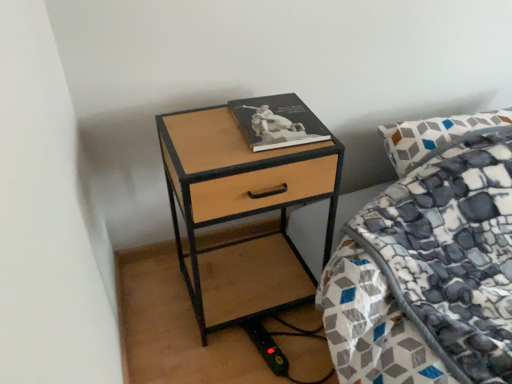
In order to face woodenmaterial/texturenightstand at center, should I rotate leftwards or rightwards?

To face it directly, rotate left by 1.128 degrees.

The height and width of the screenshot is (384, 512). Describe the element at coordinates (239, 188) in the screenshot. I see `woodenmaterial/texturenightstand at center` at that location.

Locate an element on the screen. woodenmaterial/texturenightstand at center is located at coordinates (239, 188).

Measure the distance between point (x=302, y=110) and camera.

Point (x=302, y=110) is 1.16 meters from camera.

What do you see at coordinates (277, 122) in the screenshot? The image size is (512, 384). I see `hardcover book at upper right` at bounding box center [277, 122].

Find the location of a particular element. This screenshot has height=384, width=512. hardcover book at upper right is located at coordinates (277, 122).

The height and width of the screenshot is (384, 512). Identify the location of woodenmaterial/texturenightstand at center. (239, 188).

Which object is positioned more to the right, woodenmaterial/texturenightstand at center or hardcover book at upper right?

Positioned to the right is hardcover book at upper right.

Is woodenmaterial/texturenightstand at center behind hardcover book at upper right?

No, it is not.

In the scene shown: Which point is more forward, (182, 151) or (268, 111)?

Positioned in front is point (182, 151).

From the image's perspective, is woodenmaterial/texturenightstand at center located above or below hardcover book at upper right?

Clearly, from the image's perspective, woodenmaterial/texturenightstand at center is below hardcover book at upper right.

From a real-world perspective, which object stands above the other?

In real-world perspective, hardcover book at upper right is above.

Is woodenmaterial/texturenightstand at center wider than hardcover book at upper right?

Yes.

Does woodenmaterial/texturenightstand at center have a greater height compared to hardcover book at upper right?

Indeed, woodenmaterial/texturenightstand at center has a greater height compared to hardcover book at upper right.

Considering the relative sizes of woodenmaterial/texturenightstand at center and hardcover book at upper right in the image provided, is woodenmaterial/texturenightstand at center smaller than hardcover book at upper right?

No.

Consider the image. Is woodenmaterial/texturenightstand at center not inside hardcover book at upper right?

Yes, woodenmaterial/texturenightstand at center is outside of hardcover book at upper right.

Are woodenmaterial/texturenightstand at center and hardcover book at upper right beside each other?

woodenmaterial/texturenightstand at center and hardcover book at upper right are not in contact.

Is woodenmaterial/texturenightstand at center looking in the opposite direction of hardcover book at upper right?

No, woodenmaterial/texturenightstand at center is not facing the opposite direction of hardcover book at upper right.

How many degrees apart are the facing directions of woodenmaterial/texturenightstand at center and hardcover book at upper right?

There is a 3.31-degree angle between the facing directions of woodenmaterial/texturenightstand at center and hardcover book at upper right.

How far apart are woodenmaterial/texturenightstand at center and hardcover book at upper right?

woodenmaterial/texturenightstand at center is 20.64 centimeters from hardcover book at upper right.

I want to click on nightstand below the hardcover book at upper right (from the image's perspective), so click(x=239, y=188).

Would you say hardcover book at upper right is to the left or to the right of woodenmaterial/texturenightstand at center in the picture?

hardcover book at upper right is to the right of woodenmaterial/texturenightstand at center.

Is hardcover book at upper right behind woodenmaterial/texturenightstand at center?

Yes, the depth of hardcover book at upper right is greater than that of woodenmaterial/texturenightstand at center.

Which is less distant, [319,129] or [333,205]?

The point [319,129] is closer to the camera.

From the image's perspective, between hardcover book at upper right and woodenmaterial/texturenightstand at center, who is located below?

woodenmaterial/texturenightstand at center.

From a real-world perspective, between hardcover book at upper right and woodenmaterial/texturenightstand at center, who is vertically lower?

woodenmaterial/texturenightstand at center, from a real-world perspective.

Considering the relative sizes of hardcover book at upper right and woodenmaterial/texturenightstand at center in the image provided, is hardcover book at upper right wider than woodenmaterial/texturenightstand at center?

Incorrect, the width of hardcover book at upper right does not surpass that of woodenmaterial/texturenightstand at center.

Which of these two, hardcover book at upper right or woodenmaterial/texturenightstand at center, stands shorter?

hardcover book at upper right.

In the scene shown: Who is smaller, hardcover book at upper right or woodenmaterial/texturenightstand at center?

hardcover book at upper right is smaller.

Is hardcover book at upper right completely or partially outside of woodenmaterial/texturenightstand at center?

Indeed, hardcover book at upper right is completely outside woodenmaterial/texturenightstand at center.

Is there a large distance between hardcover book at upper right and woodenmaterial/texturenightstand at center?

No, hardcover book at upper right is in close proximity to woodenmaterial/texturenightstand at center.

Is hardcover book at upper right positioned with its back to woodenmaterial/texturenightstand at center?

No, hardcover book at upper right's orientation is not away from woodenmaterial/texturenightstand at center.

What's the angular difference between hardcover book at upper right and woodenmaterial/texturenightstand at center's facing directions?

The angle between the facing direction of hardcover book at upper right and the facing direction of woodenmaterial/texturenightstand at center is 3.31 degrees.

In order to click on book located above the woodenmaterial/texturenightstand at center (from a real-world perspective) in this screenshot , I will do `click(277, 122)`.

Locate an element on the screen. The width and height of the screenshot is (512, 384). nightstand below the hardcover book at upper right (from a real-world perspective) is located at coordinates (239, 188).

The image size is (512, 384). Identify the location of nightstand lying in front of the hardcover book at upper right. (239, 188).